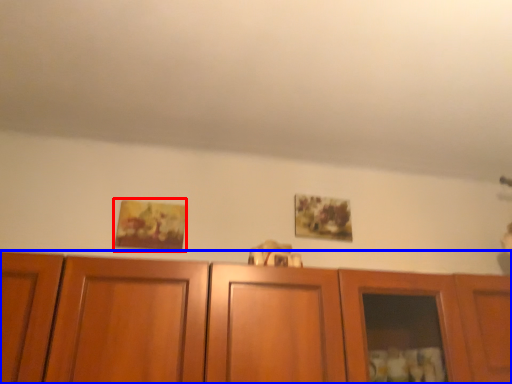
Question: Among these objects, which one is nearest to the camera, picture frame (highlighted by a red box) or cabinetry (highlighted by a blue box)?

Choices:
 (A) picture frame
 (B) cabinetry

Answer: (B)